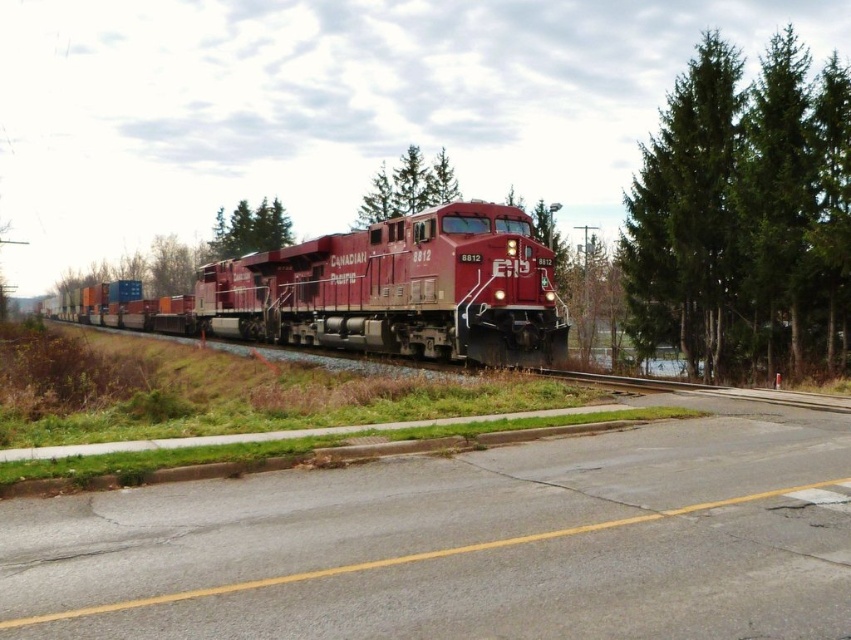
You are a passenger on the matte red locomotive at center. Looking out the window, you notice the green textured tree at center. Is the tree above or below the locomotive?

The matte red locomotive at center is positioned under the green textured tree at center, so the tree is above the locomotive.

Consider the image. You are a photographer positioned on the road near the railway track. You want to capture a photo of the matte red locomotive at center and the green textured tree at center. Given that your camera frame can only accommodate objects up to the width of the road, which object might not fit entirely within the frame if positioned centrally?

The matte red locomotive at center might not fit entirely within the frame because its width surpasses that of the green textured tree at center.